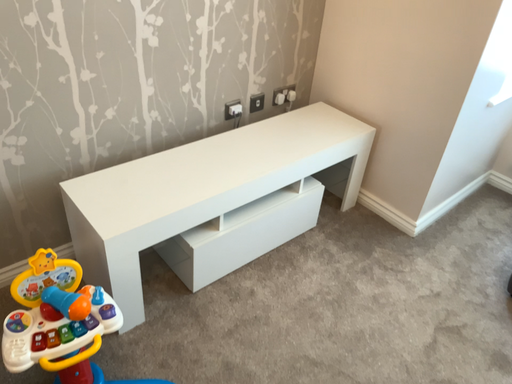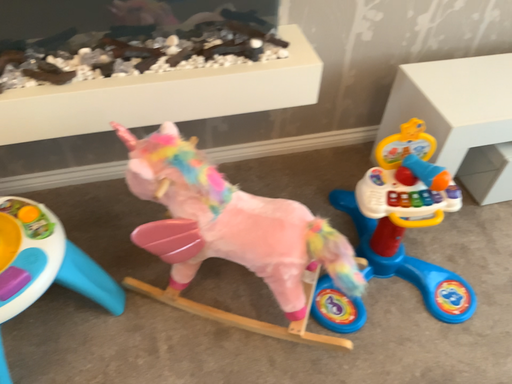
Question: How did the camera likely rotate when shooting the video?

Choices:
 (A) rotated downward
 (B) rotated upward

Answer: (A)